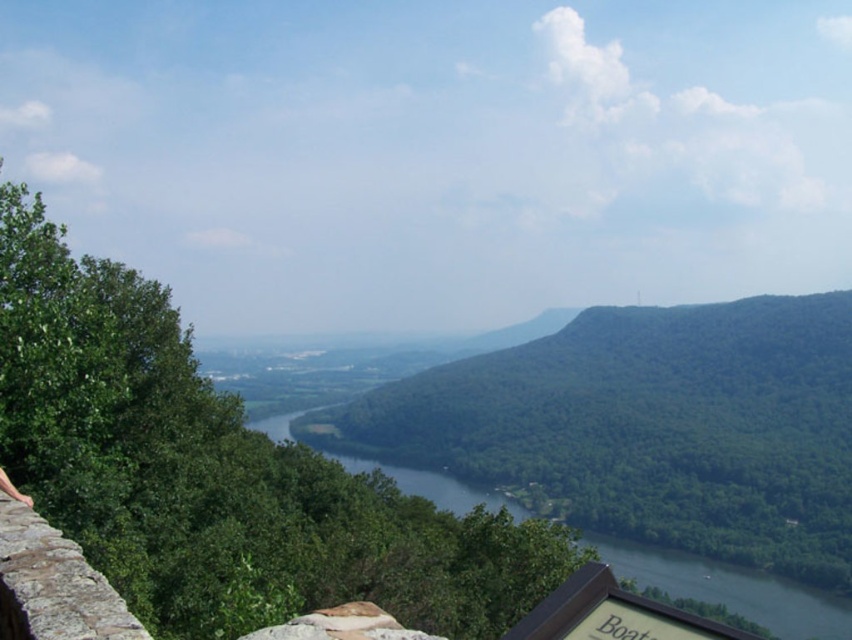
From the picture: You are planning to take a photo of the green glossy water at center and the wooden signboard at lower right. Which object will occupy more space in the photo frame?

The green glossy water at center will occupy more space in the photo frame because its width is larger than that of the wooden signboard at lower right.